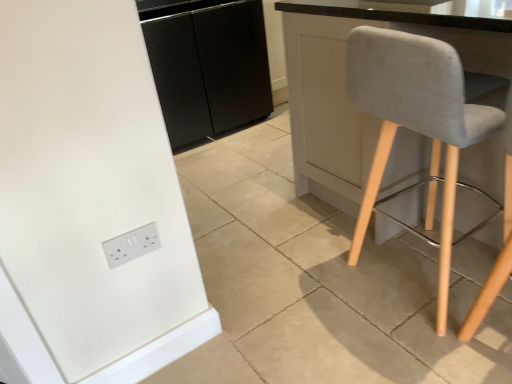
Find the location of `white plastic socket at lower left`. white plastic socket at lower left is located at coordinates (131, 245).

How much distance is there between black matte cabinet at center and light gray fabric chair at right?

They are 5.20 feet apart.

From a real-world perspective, between black matte cabinet at center and light gray fabric chair at right, who is vertically higher?

In real-world perspective, black matte cabinet at center is above.

From the image's perspective, is black matte cabinet at center located above light gray fabric chair at right?

Yes.

Considering the sizes of objects black matte cabinet at center and light gray fabric chair at right in the image provided, who is wider, black matte cabinet at center or light gray fabric chair at right?

Wider between the two is black matte cabinet at center.

Is white plastic socket at lower left not near light gray fabric chair at right?

No, there isn't a large distance between white plastic socket at lower left and light gray fabric chair at right.

Consider the image. Do you think white plastic socket at lower left is within light gray fabric chair at right, or outside of it?

The correct answer is: outside.

Can you confirm if white plastic socket at lower left is positioned to the left of light gray fabric chair at right?

Yes.

Who is taller, white plastic socket at lower left or light gray fabric chair at right?

Standing taller between the two is light gray fabric chair at right.

Considering the relative sizes of white plastic socket at lower left and black matte cabinet at center in the image provided, is white plastic socket at lower left shorter than black matte cabinet at center?

Correct, white plastic socket at lower left is not as tall as black matte cabinet at center.

This screenshot has width=512, height=384. I want to click on socket that appears below the black matte cabinet at center (from a real-world perspective), so click(131, 245).

Based on the photo, is white plastic socket at lower left far from black matte cabinet at center?

Indeed, white plastic socket at lower left is not near black matte cabinet at center.

Does point (120, 261) come in front of point (259, 36)?

Yes, point (120, 261) is in front of point (259, 36).

In the scene shown: Which of these two, black matte cabinet at center or white plastic socket at lower left, is thinner?

Thinner between the two is white plastic socket at lower left.

Considering the sizes of black matte cabinet at center and white plastic socket at lower left in the image, is black matte cabinet at center taller or shorter than white plastic socket at lower left?

Considering their sizes, black matte cabinet at center has more height than white plastic socket at lower left.

From the image's perspective, relative to white plastic socket at lower left, is black matte cabinet at center above or below?

From the image's perspective, black matte cabinet at center appears above white plastic socket at lower left.

Can you see black matte cabinet at center touching white plastic socket at lower left?

No, black matte cabinet at center is not beside white plastic socket at lower left.

Is white plastic socket at lower left completely or partially inside light gray fabric chair at right?

That's incorrect, white plastic socket at lower left is not inside light gray fabric chair at right.

Does light gray fabric chair at right have a larger size compared to white plastic socket at lower left?

Yes, light gray fabric chair at right is bigger than white plastic socket at lower left.

Is light gray fabric chair at right beside white plastic socket at lower left?

light gray fabric chair at right and white plastic socket at lower left are clearly separated.

Which is further, (416, 121) or (149, 240)?

The point (149, 240) is more distant.

Which object is further away from the camera, light gray fabric chair at right or black matte cabinet at center?

black matte cabinet at center.

Is black matte cabinet at center at the back of light gray fabric chair at right?

No, light gray fabric chair at right is not facing the opposite direction of black matte cabinet at center.

Which of these two, light gray fabric chair at right or black matte cabinet at center, is thinner?

With smaller width is light gray fabric chair at right.

Can black matte cabinet at center be found inside light gray fabric chair at right?

No, light gray fabric chair at right does not contain black matte cabinet at center.

Identify the location of cabinetry that appears behind the light gray fabric chair at right. The image size is (512, 384). (207, 65).

You are a GUI agent. You are given a task and a screenshot of the screen. Output one action in this format:
    pyautogui.click(x=<x>, y=<y>)
    Task: Click on the socket above the light gray fabric chair at right (from a real-world perspective)
    
    Given the screenshot: What is the action you would take?
    pyautogui.click(x=131, y=245)

Based on their spatial positions, is light gray fabric chair at right or black matte cabinet at center further from white plastic socket at lower left?

black matte cabinet at center is positioned further to the anchor white plastic socket at lower left.

Based on their spatial positions, is white plastic socket at lower left or black matte cabinet at center further from light gray fabric chair at right?

black matte cabinet at center is positioned further to the anchor light gray fabric chair at right.

When comparing their distances from white plastic socket at lower left, does black matte cabinet at center or light gray fabric chair at right seem further?

black matte cabinet at center is positioned further to the anchor white plastic socket at lower left.

Looking at the image, which one is located closer to light gray fabric chair at right, black matte cabinet at center or white plastic socket at lower left?

Among the two, white plastic socket at lower left is located nearer to light gray fabric chair at right.

Based on their spatial positions, is light gray fabric chair at right or white plastic socket at lower left closer to black matte cabinet at center?

light gray fabric chair at right is positioned closer to the anchor black matte cabinet at center.

Based on their spatial positions, is white plastic socket at lower left or light gray fabric chair at right closer to black matte cabinet at center?

light gray fabric chair at right lies closer to black matte cabinet at center than the other object.

This screenshot has height=384, width=512. I want to click on socket located between light gray fabric chair at right and black matte cabinet at center in the depth direction, so click(131, 245).